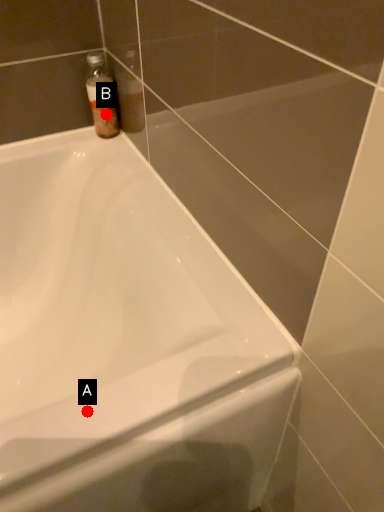
Question: Two points are circled on the image, labeled by A and B beside each circle. Which point appears closest to the camera in this image?

Choices:
 (A) A is closer
 (B) B is closer

Answer: (A)